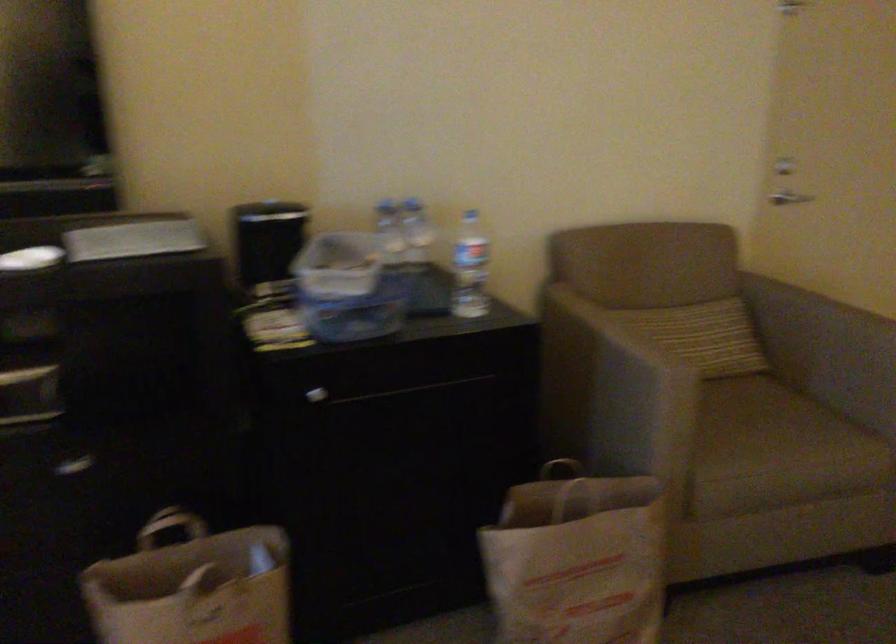
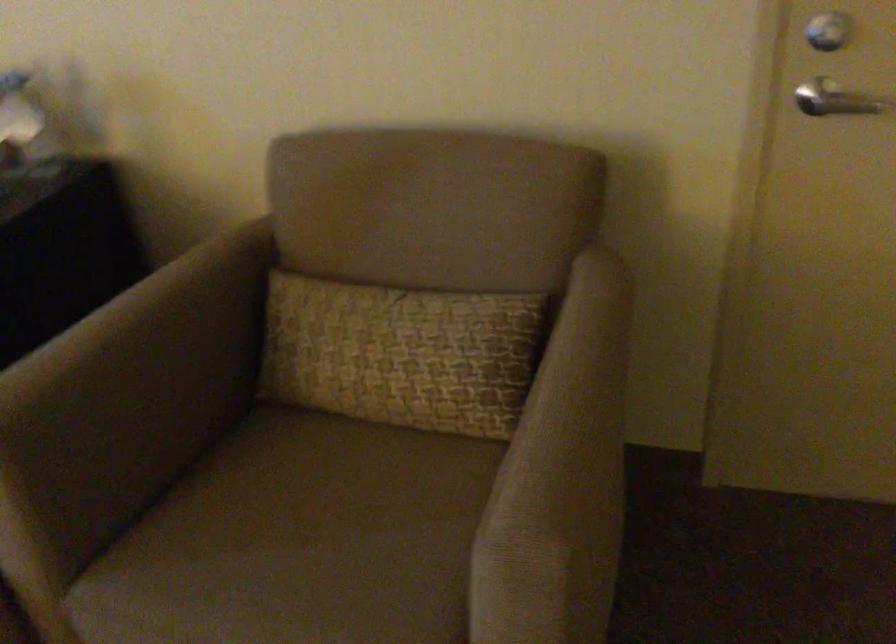
The point at (649, 359) is marked in the first image. Where is the corresponding point in the second image?

(135, 389)